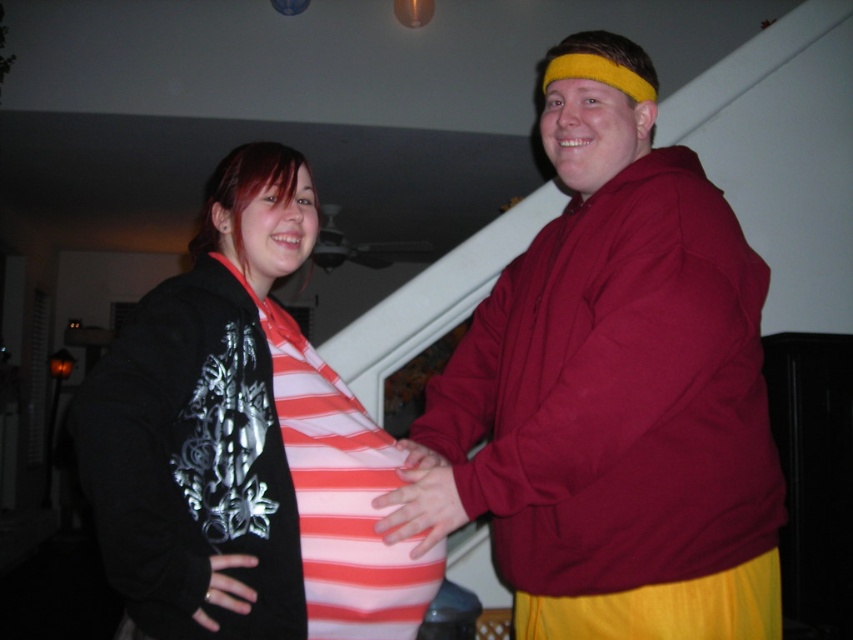
Is the position of maroon hoodie at center less distant than that of black matte ring at lower left?

That is False.

Who is positioned more to the left, maroon hoodie at center or black matte ring at lower left?

From the viewer's perspective, black matte ring at lower left appears more on the left side.

Between point (599, 141) and point (234, 600), which one is positioned in front?

Point (234, 600) is more forward.

You are a GUI agent. You are given a task and a screenshot of the screen. Output one action in this format:
    pyautogui.click(x=<x>, y=<y>)
    Task: Click on the maroon hoodie at center
    Image resolution: width=853 pixels, height=640 pixels.
    Given the screenshot: What is the action you would take?
    pyautogui.click(x=619, y=397)

How distant is maroon hoodie at center from striped fabric shirt at center?

maroon hoodie at center is 13.83 inches away from striped fabric shirt at center.

Which is in front, point (614, 609) or point (144, 330)?

Point (144, 330)

Find the location of a particular element. maroon hoodie at center is located at coordinates (619, 397).

Which is in front, point (706, 552) or point (381, 508)?

Point (706, 552) is more forward.

How much distance is there between maroon hoodie at center and pink fabric hand at center?

They are 27.99 centimeters apart.

Image resolution: width=853 pixels, height=640 pixels. I want to click on maroon hoodie at center, so click(619, 397).

Identify the location of maroon hoodie at center. (619, 397).